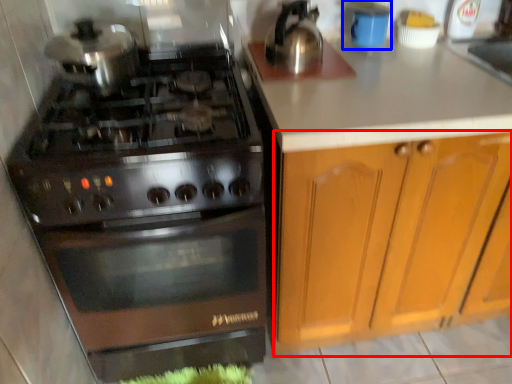
Question: Which point is further to the camera, cabinetry (highlighted by a red box) or appliance (highlighted by a blue box)?

Choices:
 (A) cabinetry
 (B) appliance

Answer: (B)